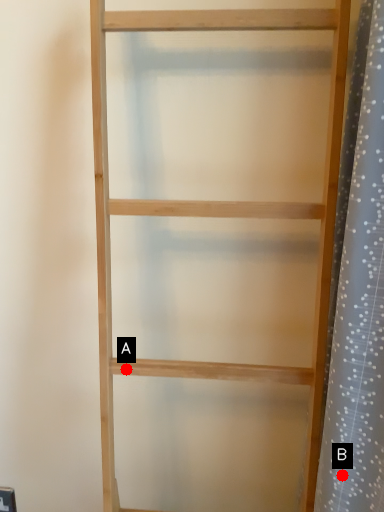
Question: Two points are circled on the image, labeled by A and B beside each circle. Which point is closer to the camera?

Choices:
 (A) A is closer
 (B) B is closer

Answer: (B)